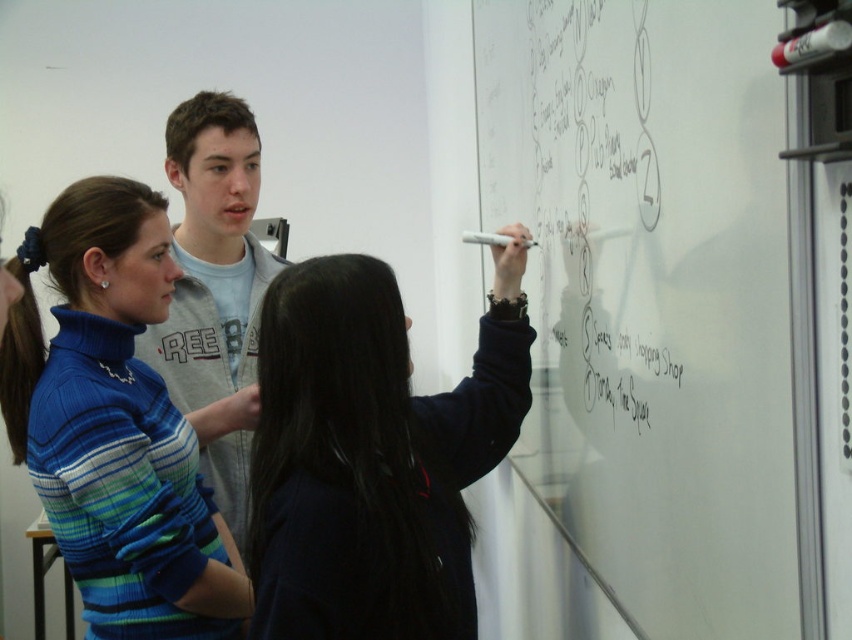
Question: Does dark blue sweater at center have a smaller size compared to blue striped sweater at left?

Choices:
 (A) yes
 (B) no

Answer: (B)

Question: Is dark blue sweater at center smaller than light gray sweatshirt at center?

Choices:
 (A) no
 (B) yes

Answer: (B)

Question: Which object is the closest to the blue striped sweater at left?

Choices:
 (A) dark blue sweater at center
 (B) white matte board at center
 (C) light gray sweatshirt at center

Answer: (C)

Question: Which point is closer to the camera?

Choices:
 (A) white matte board at center
 (B) light gray sweatshirt at center

Answer: (A)

Question: Does white matte board at center have a greater width compared to dark blue sweater at center?

Choices:
 (A) yes
 (B) no

Answer: (B)

Question: Which object is closer to the camera taking this photo?

Choices:
 (A) white matte board at center
 (B) dark blue sweater at center

Answer: (A)